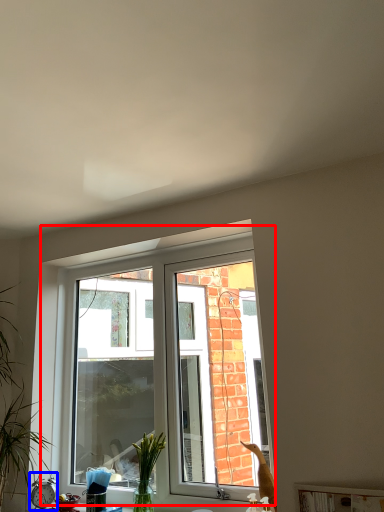
Question: Which object appears farthest to the camera in this image, window (highlighted by a red box) or alarm clock (highlighted by a blue box)?

Choices:
 (A) window
 (B) alarm clock

Answer: (B)